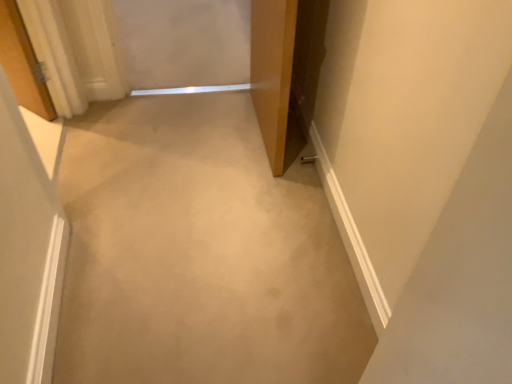
Where is `wooden door at center`? wooden door at center is located at coordinates [274, 78].

What do you see at coordinates (274, 78) in the screenshot? I see `wooden door at center` at bounding box center [274, 78].

What is the approximate width of wooden door at center?

The width of wooden door at center is 5.71 inches.

The height and width of the screenshot is (384, 512). What do you see at coordinates (199, 253) in the screenshot? I see `beige carpet at center` at bounding box center [199, 253].

What is the approximate height of beige carpet at center?

beige carpet at center is 0.94 inches tall.

The image size is (512, 384). Identify the location of beige carpet at center. tap(199, 253).

In order to click on wooden door at center in this screenshot , I will do `click(274, 78)`.

Visually, is beige carpet at center positioned to the left or to the right of wooden door at center?

From the image, it's evident that beige carpet at center is to the left of wooden door at center.

Which object is further away from the camera, beige carpet at center or wooden door at center?

wooden door at center.

Is point (339, 274) positioned in front of point (259, 96)?

Yes, it is in front of point (259, 96).

From the image's perspective, is beige carpet at center located above or below wooden door at center?

Based on their image positions, beige carpet at center is located beneath wooden door at center.

From a real-world perspective, is beige carpet at center beneath wooden door at center?

Yes, from a real-world perspective, beige carpet at center is below wooden door at center.

Which object is thinner, beige carpet at center or wooden door at center?

Thinner between the two is wooden door at center.

Considering the sizes of objects beige carpet at center and wooden door at center in the image provided, who is shorter, beige carpet at center or wooden door at center?

With less height is beige carpet at center.

Who is smaller, beige carpet at center or wooden door at center?

With smaller size is beige carpet at center.

Choose the correct answer: Is beige carpet at center inside wooden door at center or outside it?

beige carpet at center exists outside the volume of wooden door at center.

Is beige carpet at center directly adjacent to wooden door at center?

beige carpet at center and wooden door at center are not in contact.

Does beige carpet at center turn towards wooden door at center?

No, beige carpet at center does not turn towards wooden door at center.

How many degrees apart are the facing directions of beige carpet at center and wooden door at center?

beige carpet at center and wooden door at center are facing 83.3 degrees away from each other.

How far apart are beige carpet at center and wooden door at center?

The distance of beige carpet at center from wooden door at center is 53.25 centimeters.

Locate an element on the screen. door on the right of beige carpet at center is located at coordinates [x=274, y=78].

Would you say wooden door at center is to the left or to the right of beige carpet at center in the picture?

Based on their positions, wooden door at center is located to the right of beige carpet at center.

Considering the relative positions of wooden door at center and beige carpet at center in the image provided, is wooden door at center in front of beige carpet at center?

No.

Is point (259, 82) positioned behind point (83, 178)?

That is True.

From the image's perspective, is wooden door at center over beige carpet at center?

Correct, wooden door at center appears higher than beige carpet at center in the image.

From a real-world perspective, which object rests below the other?

From a 3D spatial view, beige carpet at center is below.

Based on the photo, considering the sizes of objects wooden door at center and beige carpet at center in the image provided, who is thinner, wooden door at center or beige carpet at center?

With smaller width is wooden door at center.

Does wooden door at center have a greater height compared to beige carpet at center?

Indeed, wooden door at center has a greater height compared to beige carpet at center.

Who is bigger, wooden door at center or beige carpet at center?

With larger size is wooden door at center.

Is wooden door at center not within beige carpet at center?

Yes, wooden door at center is not within beige carpet at center.

Is wooden door at center far from beige carpet at center?

No, wooden door at center is in close proximity to beige carpet at center.

Could you tell me if wooden door at center is turned towards beige carpet at center?

Yes, wooden door at center is turned towards beige carpet at center.

How different are the orientations of wooden door at center and beige carpet at center in degrees?

wooden door at center and beige carpet at center are facing 83.3 degrees away from each other.

The width and height of the screenshot is (512, 384). What are the coordinates of `door positioned vertically above the beige carpet at center (from a real-world perspective)` in the screenshot? It's located at (274, 78).

Locate an element on the screen. This screenshot has height=384, width=512. concrete directly beneath the wooden door at center (from a real-world perspective) is located at coordinates (199, 253).

This screenshot has height=384, width=512. In order to click on door on the right of beige carpet at center in this screenshot , I will do `click(274, 78)`.